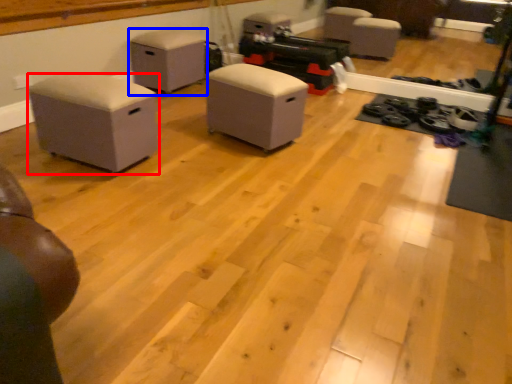
Question: Among these objects, which one is farthest to the camera, furniture (highlighted by a red box) or furniture (highlighted by a blue box)?

Choices:
 (A) furniture
 (B) furniture

Answer: (B)